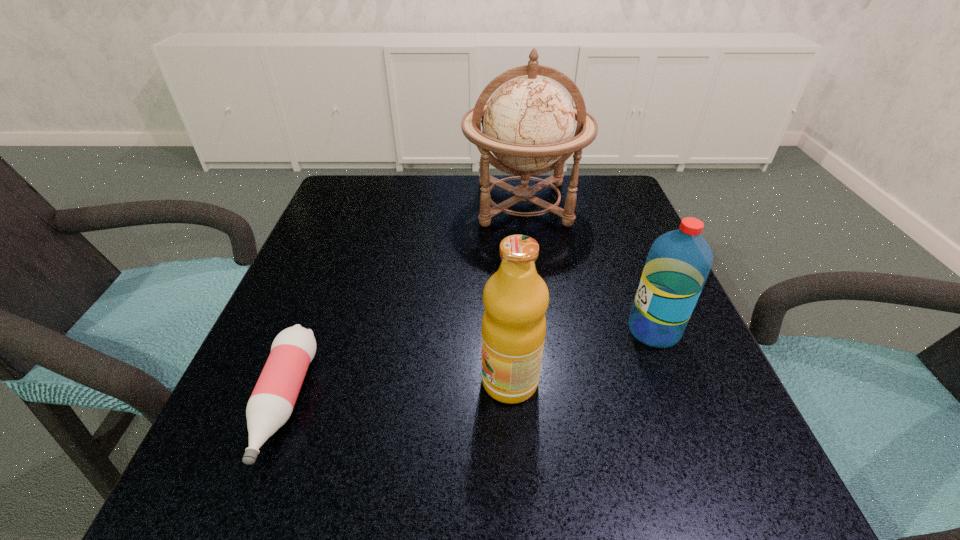
Identify the location of vacant space located on the front label of the fruit juice. The image size is (960, 540). (331, 381).

At what (x,y) coordinates should I click in order to perform the action: click on free space located on the front label of the second shortest object. Please return your answer as a coordinate pair (x, y). Looking at the image, I should click on (399, 330).

Image resolution: width=960 pixels, height=540 pixels. Find the location of `free spot located on the front label of the second shortest object`. free spot located on the front label of the second shortest object is located at coordinates (499, 330).

What are the coordinates of `vacant space located on the front label of the second shortest object` in the screenshot? It's located at (540, 330).

Locate an element on the screen. The image size is (960, 540). object at the far edge is located at coordinates (528, 124).

The image size is (960, 540). In order to click on object located in the near edge section of the desktop in this screenshot , I will do `click(272, 401)`.

Find the location of a particular element. This screenshot has height=540, width=960. object located in the left edge section of the desktop is located at coordinates (272, 401).

Find the location of `globe located at the right edge`. globe located at the right edge is located at coordinates [x=528, y=124].

Identify the location of water bottle that is at the right edge. point(679,261).

Where is `object that is at the near left corner`? Image resolution: width=960 pixels, height=540 pixels. object that is at the near left corner is located at coordinates (272, 401).